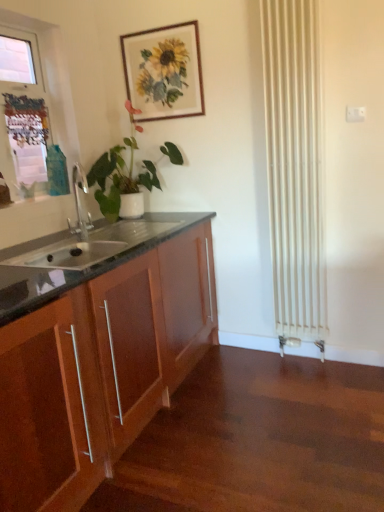
Question: From a real-world perspective, is white plastic window frame at upper left above or below wooden cabinet at left?

Choices:
 (A) above
 (B) below

Answer: (A)

Question: In terms of height, does white plastic window frame at upper left look taller or shorter compared to wooden cabinet at left?

Choices:
 (A) short
 (B) tall

Answer: (A)

Question: Based on their relative distances, which object is farther from the white plastic window frame at upper left?

Choices:
 (A) wooden cabinet at left
 (B) green matte plant at left
 (C) wooden picture frame at upper center

Answer: (A)

Question: Which object is the closest to the wooden cabinet at left?

Choices:
 (A) white plastic window frame at upper left
 (B) green matte plant at left
 (C) wooden picture frame at upper center

Answer: (B)